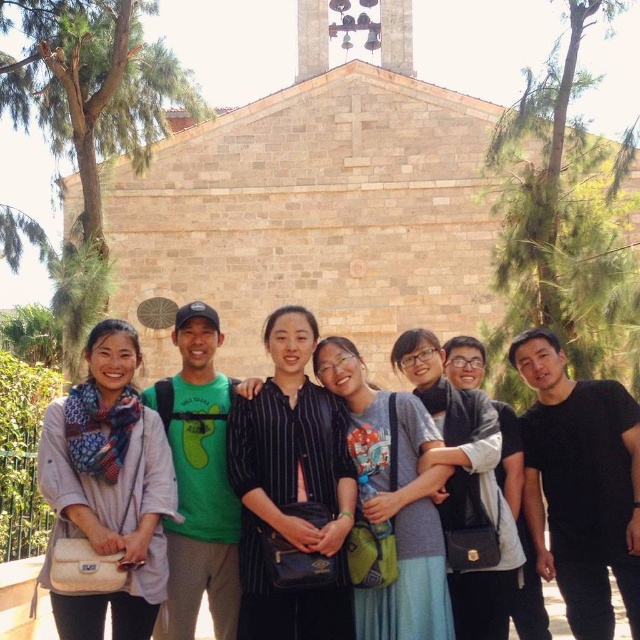
Can you confirm if matte scarf at left is positioned to the left of striped fabric shirt at center?

Correct, you'll find matte scarf at left to the left of striped fabric shirt at center.

Is matte scarf at left to the right of striped fabric shirt at center from the viewer's perspective?

No, matte scarf at left is not to the right of striped fabric shirt at center.

Is point (99, 468) behind point (276, 448)?

No.

This screenshot has width=640, height=640. Identify the location of matte scarf at left. (108, 486).

This screenshot has width=640, height=640. Identify the location of matte scarf at left. (108, 486).

Can you confirm if matte scarf at left is positioned above striped shirt at center?

No, matte scarf at left is not above striped shirt at center.

You are a GUI agent. You are given a task and a screenshot of the screen. Output one action in this format:
    pyautogui.click(x=<x>, y=<y>)
    Task: Click on the matte scarf at left
    
    Given the screenshot: What is the action you would take?
    pyautogui.click(x=108, y=486)

From the picture: Is striped fabric shirt at center wider than striped shirt at center?

Correct, the width of striped fabric shirt at center exceeds that of striped shirt at center.

Is striped fabric shirt at center bigger than striped shirt at center?

Actually, striped fabric shirt at center might be smaller than striped shirt at center.

Is point (333, 436) closer to camera compared to point (456, 515)?

No, it is behind (456, 515).

Locate an element on the screen. This screenshot has width=640, height=640. striped fabric shirt at center is located at coordinates (291, 486).